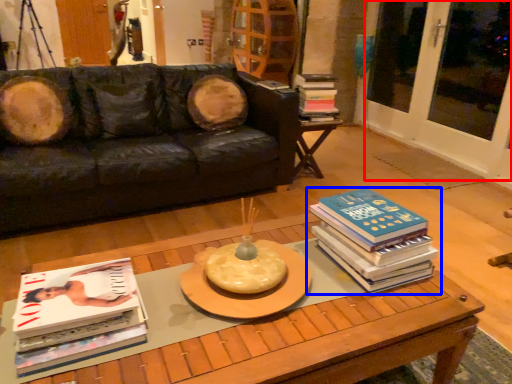
Question: Which object appears farthest to the camera in this image, screen door (highlighted by a red box) or book (highlighted by a blue box)?

Choices:
 (A) screen door
 (B) book

Answer: (A)